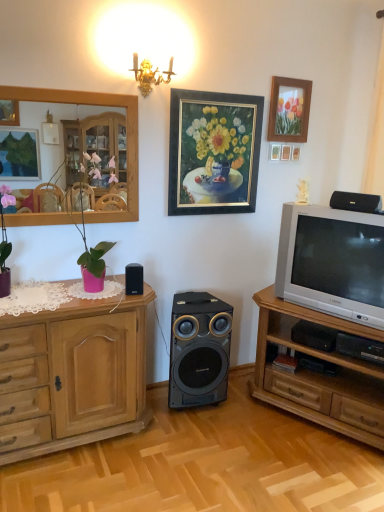
The width and height of the screenshot is (384, 512). What do you see at coordinates (289, 110) in the screenshot?
I see `wooden picture frame at upper right, acting as the 2th picture frame starting from the left` at bounding box center [289, 110].

Describe the element at coordinates (213, 152) in the screenshot. I see `gold-framed painting at upper center, which is counted as the first picture frame, starting from the left` at that location.

From the picture: Measure the distance between point (130, 271) and camera.

The distance of point (130, 271) from camera is 7.19 feet.

Where is `black plastic speaker at center, placed as the second loudspeaker when sorted from back to front`? This screenshot has width=384, height=512. black plastic speaker at center, placed as the second loudspeaker when sorted from back to front is located at coordinates 134,279.

Find the location of a particular element. The width and height of the screenshot is (384, 512). wooden picture frame at upper right, positioned as the 1th picture frame in right-to-left order is located at coordinates (289, 110).

Visually, is gold-framed painting at upper center, the second picture frame viewed from the right, positioned to the left or to the right of wooden picture frame at upper right, acting as the 2th picture frame starting from the left?

gold-framed painting at upper center, the second picture frame viewed from the right, is to the left of wooden picture frame at upper right, acting as the 2th picture frame starting from the left.

Does gold-framed painting at upper center, which is counted as the first picture frame, starting from the left, have a lesser height compared to wooden picture frame at upper right, positioned as the 1th picture frame in right-to-left order?

Incorrect, the height of gold-framed painting at upper center, which is counted as the first picture frame, starting from the left, does not fall short of that of wooden picture frame at upper right, positioned as the 1th picture frame in right-to-left order.

From the image's perspective, who appears lower, gold-framed painting at upper center, which is counted as the first picture frame, starting from the left, or wooden picture frame at upper right, positioned as the 1th picture frame in right-to-left order?

gold-framed painting at upper center, which is counted as the first picture frame, starting from the left, appears lower in the image.

From a real-world perspective, is gold-framed painting at upper center, which is counted as the first picture frame, starting from the left, physically located above or below wooden picture frame at upper right, positioned as the 1th picture frame in right-to-left order?

From a real-world perspective, gold-framed painting at upper center, which is counted as the first picture frame, starting from the left, is physically below wooden picture frame at upper right, positioned as the 1th picture frame in right-to-left order.

At what (x,y) coordinates should I click in order to perform the action: click on loudspeaker that is the 3rd object directly below the wooden mirror at upper left (from a real-world perspective). Please return your answer as a coordinate pair (x, y). This screenshot has width=384, height=512. Looking at the image, I should click on (199, 349).

From a real-world perspective, is wooden mirror at upper left on black plastic speaker at center, marked as the first loudspeaker in a bottom-to-top arrangement?

Yes, from a real-world perspective, wooden mirror at upper left is above black plastic speaker at center, marked as the first loudspeaker in a bottom-to-top arrangement.

Is point (33, 109) in front of point (207, 321)?

Yes, point (33, 109) is in front of point (207, 321).

Can you see wooden mirror at upper left touching black plastic speaker at center, acting as the first loudspeaker starting from the back?

wooden mirror at upper left and black plastic speaker at center, acting as the first loudspeaker starting from the back, are clearly separated.

Which object is positioned more to the right, matte pink pot at left or black plastic speaker at upper right, acting as the first loudspeaker starting from the right?

black plastic speaker at upper right, acting as the first loudspeaker starting from the right, is more to the right.

Between matte pink pot at left and black plastic speaker at upper right, acting as the first loudspeaker starting from the right, which one has larger width?

matte pink pot at left is wider.

Consider the image. Is black plastic speaker at upper right, which ranks as the third loudspeaker in bottom-to-top order, at the back of matte pink pot at left?

No.

What's the angular difference between matte pink pot at left and black plastic speaker at upper right, marked as the 3th loudspeaker in a back-to-front arrangement,'s facing directions?

The angle between the facing direction of matte pink pot at left and the facing direction of black plastic speaker at upper right, marked as the 3th loudspeaker in a back-to-front arrangement, is 65.5 degrees.

Who is taller, wooden cabinet at left or matte pink pot at left?

wooden cabinet at left.

Which is more to the right, wooden cabinet at left or matte pink pot at left?

From the viewer's perspective, wooden cabinet at left appears more on the right side.

From the image's perspective, which object appears higher, wooden cabinet at left or matte pink pot at left?

matte pink pot at left appears higher in the image.

Which is more distant, (285,249) or (172,354)?

The point (172,354) is behind.

Are silver metallic television at right and black plastic speaker at center, the 2th loudspeaker in the right-to-left sequence, making contact?

silver metallic television at right and black plastic speaker at center, the 2th loudspeaker in the right-to-left sequence, are clearly separated.

Is silver metallic television at right surrounding black plastic speaker at center, the third loudspeaker in the front-to-back sequence?

No, black plastic speaker at center, the third loudspeaker in the front-to-back sequence, is located outside of silver metallic television at right.

From a real-world perspective, does silver metallic television at right sit lower than wooden cabinet at right?

No.

Considering the relative sizes of silver metallic television at right and wooden cabinet at right in the image provided, is silver metallic television at right taller than wooden cabinet at right?

No.

Which is farther from the camera, (x=359, y=214) or (x=371, y=380)?

The point (x=371, y=380) is farther.

Consider the image. From the image's perspective, which is below, silver metallic television at right or wooden cabinet at right?

wooden cabinet at right.

From the image's perspective, which is below, wooden cabinet at left or black plastic speaker at center, which is counted as the 2th loudspeaker, starting from the left?

wooden cabinet at left appears lower in the image.

The width and height of the screenshot is (384, 512). In order to click on cabinetry located in front of the black plastic speaker at center, acting as the first loudspeaker starting from the back in this screenshot , I will do [72, 375].

Is wooden cabinet at left positioned before black plastic speaker at center, the third loudspeaker viewed from the top?

That is True.

Considering the relative positions of wooden cabinet at left and black plastic speaker at center, marked as the first loudspeaker in a bottom-to-top arrangement, in the image provided, is wooden cabinet at left to the left of black plastic speaker at center, marked as the first loudspeaker in a bottom-to-top arrangement, from the viewer's perspective?

Indeed, wooden cabinet at left is positioned on the left side of black plastic speaker at center, marked as the first loudspeaker in a bottom-to-top arrangement.

Identify the location of picture frame above the gold-framed painting at upper center, which is counted as the first picture frame, starting from the left (from the image's perspective). This screenshot has height=512, width=384. (289, 110).

Locate an element on the screen. mirror in front of the black plastic speaker at center, marked as the first loudspeaker in a bottom-to-top arrangement is located at coordinates point(41,133).

Considering their positions, is wooden cabinet at left positioned further to silver metallic television at right than black plastic speaker at upper right, acting as the first loudspeaker starting from the right?

Based on the image, wooden cabinet at left appears to be further to silver metallic television at right.

Based on their spatial positions, is wooden cabinet at left or wooden cabinet at right closer to wooden picture frame at upper right, acting as the 2th picture frame starting from the left?

Among the two, wooden cabinet at right is located nearer to wooden picture frame at upper right, acting as the 2th picture frame starting from the left.

When comparing their distances from wooden picture frame at upper right, acting as the 2th picture frame starting from the left, does black plastic speaker at center, the third loudspeaker viewed from the top, or gold-framed painting at upper center, which is counted as the first picture frame, starting from the left, seem further?

The object further to wooden picture frame at upper right, acting as the 2th picture frame starting from the left, is black plastic speaker at center, the third loudspeaker viewed from the top.

When comparing their distances from matte pink pot at left, does gold-framed painting at upper center, the second picture frame viewed from the right, or wooden cabinet at right seem further?

Based on the image, wooden cabinet at right appears to be further to matte pink pot at left.

From the image, which object appears to be nearer to silver metallic television at right, black plastic speaker at upper right, which ranks as the 1th loudspeaker in top-to-bottom order, or wooden picture frame at upper right, acting as the 2th picture frame starting from the left?

black plastic speaker at upper right, which ranks as the 1th loudspeaker in top-to-bottom order.

Considering their positions, is wooden cabinet at left positioned closer to wooden picture frame at upper right, positioned as the 1th picture frame in right-to-left order, than gold-framed painting at upper center, which is counted as the first picture frame, starting from the left?

gold-framed painting at upper center, which is counted as the first picture frame, starting from the left.

From the image, which object appears to be nearer to wooden mirror at upper left, wooden cabinet at right or gold-framed painting at upper center, which is counted as the first picture frame, starting from the left?

gold-framed painting at upper center, which is counted as the first picture frame, starting from the left.

Looking at the image, which one is located closer to gold-framed painting at upper center, which is counted as the first picture frame, starting from the left, black plastic speaker at center, placed as the second loudspeaker when sorted from back to front, or wooden mirror at upper left?

Based on the image, wooden mirror at upper left appears to be nearer to gold-framed painting at upper center, which is counted as the first picture frame, starting from the left.

The height and width of the screenshot is (512, 384). Identify the location of cabinetry located between matte pink pot at left and silver metallic television at right in the left-right direction. (72, 375).

At what (x,y) coordinates should I click in order to perform the action: click on picture frame between gold-framed painting at upper center, the second picture frame viewed from the right, and black plastic speaker at upper right, which ranks as the third loudspeaker in bottom-to-top order, in the horizontal direction. Please return your answer as a coordinate pair (x, y). The height and width of the screenshot is (512, 384). Looking at the image, I should click on (289, 110).

You are a GUI agent. You are given a task and a screenshot of the screen. Output one action in this format:
    pyautogui.click(x=<x>, y=<y>)
    Task: Click on the television between black plastic speaker at center, which ranks as the first loudspeaker in left-to-right order, and black plastic speaker at upper right, marked as the 3th loudspeaker in a back-to-front arrangement
    This screenshot has height=512, width=384.
    Given the screenshot: What is the action you would take?
    pyautogui.click(x=332, y=262)

Identify the location of cabinetry between wooden picture frame at upper right, positioned as the 1th picture frame in right-to-left order, and wooden cabinet at right vertically. This screenshot has width=384, height=512. (72, 375).